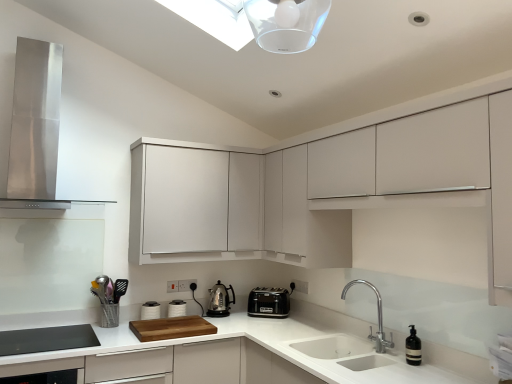
The width and height of the screenshot is (512, 384). What do you see at coordinates (219, 300) in the screenshot?
I see `polished stainless steel kettle at center, marked as the 1th kitchen appliance in a left-to-right arrangement` at bounding box center [219, 300].

Consider the image. Measure the distance between point [316,142] and camera.

The distance of point [316,142] from camera is 2.58 meters.

This screenshot has width=512, height=384. Find the location of `metallic silver utensil holder at lower left`. metallic silver utensil holder at lower left is located at coordinates (109, 298).

I want to click on black plastic toaster at center, marked as the first kitchen appliance in a right-to-left arrangement, so click(x=269, y=302).

This screenshot has width=512, height=384. Describe the element at coordinates (47, 369) in the screenshot. I see `black glass dishwasher at lower left` at that location.

The width and height of the screenshot is (512, 384). What do you see at coordinates (35, 121) in the screenshot?
I see `stainless steel range hood at upper left` at bounding box center [35, 121].

The image size is (512, 384). What are the coordinates of `polished stainless steel kettle at center, which is counted as the second kitchen appliance, starting from the right` in the screenshot? It's located at (219, 300).

Is white glossy sink at lower center not within polished stainless steel faucet at lower right?

Indeed, white glossy sink at lower center is completely outside polished stainless steel faucet at lower right.

Is white glossy sink at lower center looking in the opposite direction of polished stainless steel faucet at lower right?

No.

From the image's perspective, is white glossy sink at lower center over polished stainless steel faucet at lower right?

Incorrect, from the image's perspective, white glossy sink at lower center is lower than polished stainless steel faucet at lower right.

Which object is more forward, stainless steel range hood at upper left or polished stainless steel kettle at center, marked as the 1th kitchen appliance in a left-to-right arrangement?

Positioned in front is stainless steel range hood at upper left.

Consider the image. Could you measure the distance between stainless steel range hood at upper left and polished stainless steel kettle at center, which is counted as the second kitchen appliance, starting from the right?

stainless steel range hood at upper left and polished stainless steel kettle at center, which is counted as the second kitchen appliance, starting from the right, are 1.61 meters apart.

Is stainless steel range hood at upper left beside polished stainless steel kettle at center, marked as the 1th kitchen appliance in a left-to-right arrangement?

No, stainless steel range hood at upper left is not next to polished stainless steel kettle at center, marked as the 1th kitchen appliance in a left-to-right arrangement.

Is black glass dishwasher at lower left surrounding stainless steel range hood at upper left?

No.

Consider the image. Does black glass dishwasher at lower left have a greater width compared to stainless steel range hood at upper left?

Correct, the width of black glass dishwasher at lower left exceeds that of stainless steel range hood at upper left.

From a real-world perspective, is black glass dishwasher at lower left located beneath stainless steel range hood at upper left?

Correct, in the physical world, black glass dishwasher at lower left is lower than stainless steel range hood at upper left.

This screenshot has width=512, height=384. Identify the location of dish washer lying in front of the stainless steel range hood at upper left. (47, 369).

How different are the orientations of black plastic toaster at center, marked as the first kitchen appliance in a right-to-left arrangement, and stainless steel range hood at upper left in degrees?

They differ by 41.7 degrees in their facing directions.

How distant is black plastic toaster at center, marked as the first kitchen appliance in a right-to-left arrangement, from stainless steel range hood at upper left?

black plastic toaster at center, marked as the first kitchen appliance in a right-to-left arrangement, is 6.01 feet from stainless steel range hood at upper left.

Considering the relative sizes of black plastic toaster at center, the second kitchen appliance in the left-to-right sequence, and stainless steel range hood at upper left in the image provided, is black plastic toaster at center, the second kitchen appliance in the left-to-right sequence, wider than stainless steel range hood at upper left?

Incorrect, the width of black plastic toaster at center, the second kitchen appliance in the left-to-right sequence, does not surpass that of stainless steel range hood at upper left.

From the image's perspective, is black plastic toaster at center, the second kitchen appliance in the left-to-right sequence, above stainless steel range hood at upper left?

Incorrect, from the image's perspective, black plastic toaster at center, the second kitchen appliance in the left-to-right sequence, is lower than stainless steel range hood at upper left.

You are a GUI agent. You are given a task and a screenshot of the screen. Output one action in this format:
    pyautogui.click(x=<x>, y=<y>)
    Task: Click on the appliance above the black glass dishwasher at lower left (from a real-world perspective)
    This screenshot has width=512, height=384.
    Given the screenshot: What is the action you would take?
    pyautogui.click(x=109, y=298)

Between metallic silver utensil holder at lower left and black glass dishwasher at lower left, which one has smaller size?

Smaller between the two is metallic silver utensil holder at lower left.

Can you see metallic silver utensil holder at lower left touching black glass dishwasher at lower left?

They are not placed beside each other.

Is metallic silver utensil holder at lower left aimed at black glass dishwasher at lower left?

No, metallic silver utensil holder at lower left is not aimed at black glass dishwasher at lower left.

From the picture: Considering the relative positions of white matte cabinet at upper center, positioned as the 1th cabinetry in left-to-right order, and white glossy sink at lower center in the image provided, is white matte cabinet at upper center, positioned as the 1th cabinetry in left-to-right order, in front of white glossy sink at lower center?

No, the depth of white matte cabinet at upper center, positioned as the 1th cabinetry in left-to-right order, is greater than that of white glossy sink at lower center.

Is white matte cabinet at upper center, acting as the second cabinetry starting from the right, oriented towards white glossy sink at lower center?

No, white matte cabinet at upper center, acting as the second cabinetry starting from the right, is not aimed at white glossy sink at lower center.

Between point (163, 217) and point (311, 348), which one is positioned in front?

Point (311, 348)

How far apart are white matte cabinet at upper center, positioned as the 1th cabinetry in left-to-right order, and white glossy sink at lower center?

white matte cabinet at upper center, positioned as the 1th cabinetry in left-to-right order, is 1.18 meters away from white glossy sink at lower center.

Can you confirm if stainless steel range hood at upper left is bigger than black plastic toaster at center, the second kitchen appliance in the left-to-right sequence?

Indeed, stainless steel range hood at upper left has a larger size compared to black plastic toaster at center, the second kitchen appliance in the left-to-right sequence.

Considering the positions of objects stainless steel range hood at upper left and black plastic toaster at center, marked as the first kitchen appliance in a right-to-left arrangement, in the image provided, who is more to the left, stainless steel range hood at upper left or black plastic toaster at center, marked as the first kitchen appliance in a right-to-left arrangement,?

From the viewer's perspective, stainless steel range hood at upper left appears more on the left side.

Can you tell me how much stainless steel range hood at upper left and black plastic toaster at center, marked as the first kitchen appliance in a right-to-left arrangement, differ in facing direction?

stainless steel range hood at upper left and black plastic toaster at center, marked as the first kitchen appliance in a right-to-left arrangement, are facing 41.7 degrees away from each other.

From the image's perspective, between stainless steel range hood at upper left and black plastic toaster at center, marked as the first kitchen appliance in a right-to-left arrangement, who is located below?

black plastic toaster at center, marked as the first kitchen appliance in a right-to-left arrangement, appears lower in the image.

The width and height of the screenshot is (512, 384). In order to click on tap on the right of white glossy sink at lower center in this screenshot , I will do `click(378, 317)`.

The image size is (512, 384). In order to click on home appliance that is above the polished stainless steel kettle at center, which is counted as the second kitchen appliance, starting from the right (from the image's perspective) in this screenshot , I will do `click(35, 121)`.

From the image, which object appears to be nearer to black plastic toaster at center, marked as the first kitchen appliance in a right-to-left arrangement, polished stainless steel faucet at lower right or stainless steel range hood at upper left?

Among the two, polished stainless steel faucet at lower right is located nearer to black plastic toaster at center, marked as the first kitchen appliance in a right-to-left arrangement.

From the image, which object appears to be nearer to polished stainless steel kettle at center, marked as the 1th kitchen appliance in a left-to-right arrangement, stainless steel range hood at upper left or white glossy sink at lower center?

The object closer to polished stainless steel kettle at center, marked as the 1th kitchen appliance in a left-to-right arrangement, is white glossy sink at lower center.

When comparing their distances from black glass dishwasher at lower left, does metallic silver utensil holder at lower left or white matte cabinet at upper center, acting as the second cabinetry starting from the right, seem further?

white matte cabinet at upper center, acting as the second cabinetry starting from the right.

Based on their spatial positions, is polished stainless steel faucet at lower right or polished stainless steel kettle at center, marked as the 1th kitchen appliance in a left-to-right arrangement, closer to white matte cabinet at upper center, the second cabinetry in the left-to-right sequence?

polished stainless steel faucet at lower right is closer to white matte cabinet at upper center, the second cabinetry in the left-to-right sequence.

Estimate the real-world distances between objects in this image. Which object is further from black glass dishwasher at lower left, metallic silver utensil holder at lower left or white glossy sink at lower center?

white glossy sink at lower center is further to black glass dishwasher at lower left.

Looking at this image, considering their positions, is white matte cabinet at upper center, the second cabinetry in the left-to-right sequence, positioned further to metallic silver utensil holder at lower left than polished stainless steel faucet at lower right?

polished stainless steel faucet at lower right is positioned further to the anchor metallic silver utensil holder at lower left.

Which object lies nearer to the anchor point stainless steel range hood at upper left, black plastic toaster at center, marked as the first kitchen appliance in a right-to-left arrangement, or white matte cabinet at upper center, acting as the second cabinetry starting from the right?

white matte cabinet at upper center, acting as the second cabinetry starting from the right, is closer to stainless steel range hood at upper left.

Looking at the image, which one is located further to white glossy sink at lower center, polished stainless steel faucet at lower right or white matte cabinet at upper center, the second cabinetry in the left-to-right sequence?

white matte cabinet at upper center, the second cabinetry in the left-to-right sequence, is further to white glossy sink at lower center.

Where is `tap between black glass dishwasher at lower left and white matte cabinet at upper center, acting as the 1th cabinetry starting from the right`? The height and width of the screenshot is (384, 512). tap between black glass dishwasher at lower left and white matte cabinet at upper center, acting as the 1th cabinetry starting from the right is located at coordinates (378, 317).

I want to click on cabinetry between black glass dishwasher at lower left and white glossy sink at lower center in the horizontal direction, so click(x=177, y=204).

Identify the location of kitchen appliance between polished stainless steel faucet at lower right and polished stainless steel kettle at center, which is counted as the second kitchen appliance, starting from the right, in the front-back direction. 269,302.

Locate an element on the screen. Image resolution: width=512 pixels, height=384 pixels. tap between stainless steel range hood at upper left and white matte cabinet at upper center, acting as the 1th cabinetry starting from the right, from left to right is located at coordinates (378, 317).